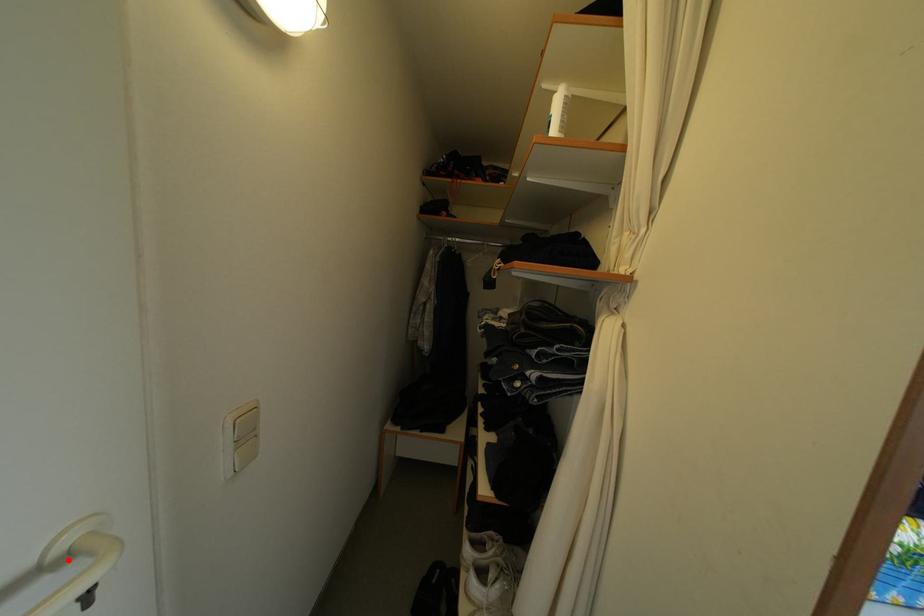
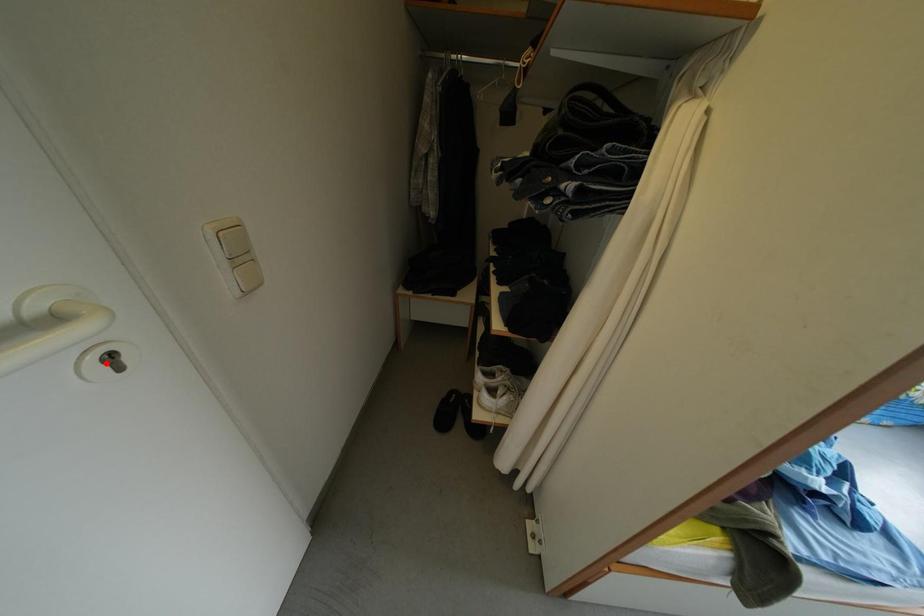
I am providing you with two images of the same scene from different viewpoints. A red point is marked on the first image and another point is marked on the second image. Are the points marked in image1 and image2 representing the same 3D position?

No